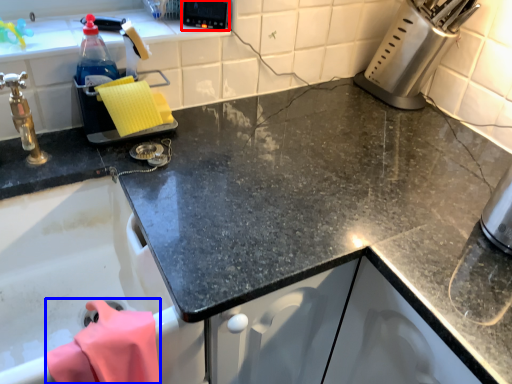
Question: Among these objects, which one is nearest to the camera, appliance (highlighted by a red box) or clothe (highlighted by a blue box)?

Choices:
 (A) appliance
 (B) clothe

Answer: (B)